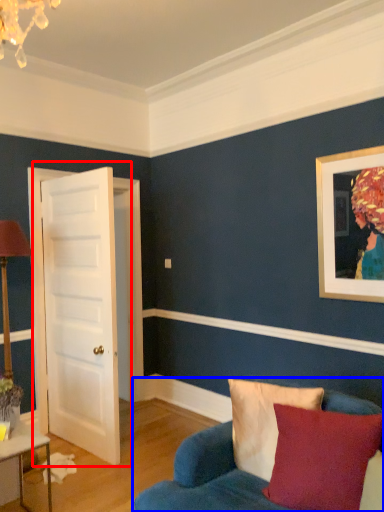
Question: Among these objects, which one is nearest to the camera, door (highlighted by a red box) or studio couch (highlighted by a blue box)?

Choices:
 (A) door
 (B) studio couch

Answer: (B)